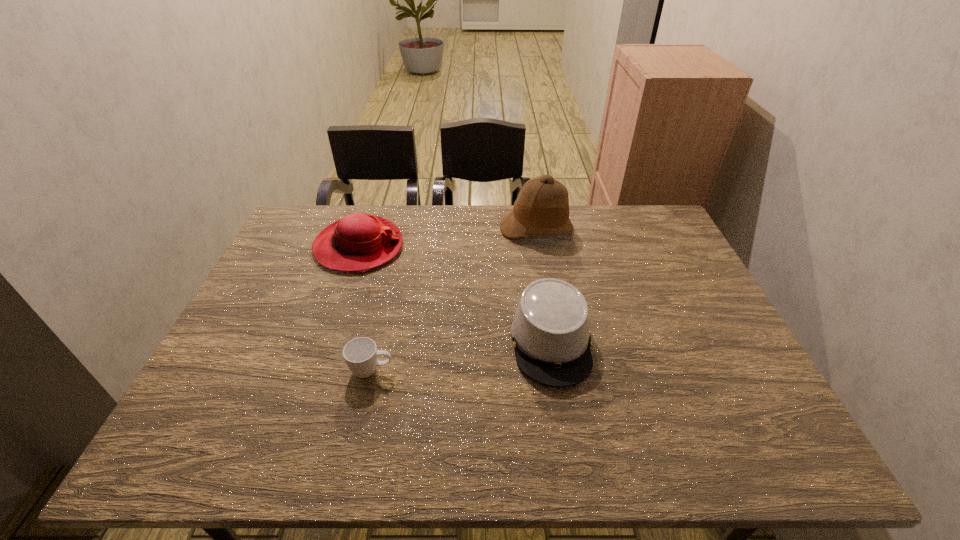
Image resolution: width=960 pixels, height=540 pixels. What are the coordinates of `the tallest hat` in the screenshot? It's located at (542, 206).

Image resolution: width=960 pixels, height=540 pixels. Find the location of `the leftmost hat`. the leftmost hat is located at coordinates (356, 243).

I want to click on the nearest hat, so click(x=550, y=331).

Where is `the shortest object`? the shortest object is located at coordinates (360, 354).

At what (x,y) coordinates should I click in order to perform the action: click on vacant space situated on the front-facing side of the tallest hat. Please return your answer as a coordinate pair (x, y). Image resolution: width=960 pixels, height=540 pixels. Looking at the image, I should click on (541, 258).

Find the location of a particular element. vacant space located at the front of the leftmost hat with a bow is located at coordinates (461, 247).

This screenshot has width=960, height=540. Identify the location of vacant region located on the front-facing side of the nearest hat. (567, 443).

This screenshot has height=540, width=960. What are the coordinates of `free space located 0.280m with the handle on the side of the cup` in the screenshot? It's located at (514, 370).

At what (x,y) coordinates should I click in order to perform the action: click on object at the left edge. Please return your answer as a coordinate pair (x, y). This screenshot has width=960, height=540. Looking at the image, I should click on (356, 243).

The height and width of the screenshot is (540, 960). Identify the location of object that is at the far left corner. pyautogui.click(x=356, y=243).